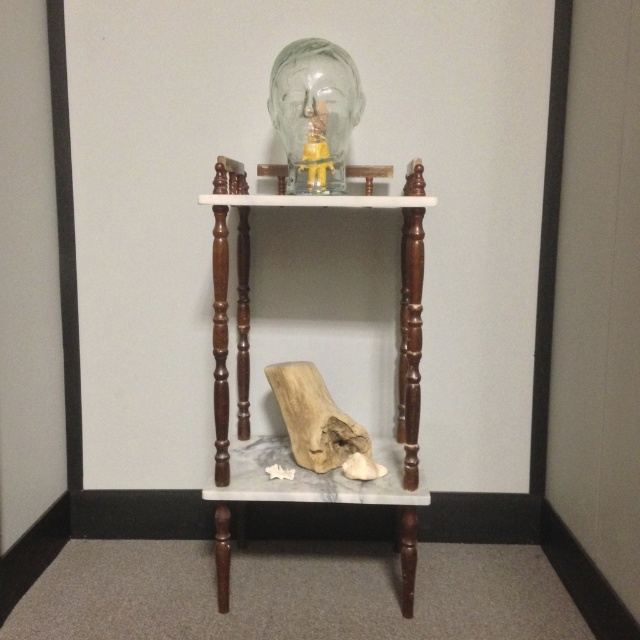
Question: Is wooden side table at center above white marble stool at lower center?

Choices:
 (A) yes
 (B) no

Answer: (A)

Question: Is wooden side table at center above white marble stool at lower center?

Choices:
 (A) no
 (B) yes

Answer: (B)

Question: Can you confirm if wooden side table at center is wider than white marble stool at lower center?

Choices:
 (A) yes
 (B) no

Answer: (A)

Question: Which point is farther from the camera taking this photo?

Choices:
 (A) (262, 440)
 (B) (205, 202)

Answer: (A)

Question: Which of the following is the closest to the observer?

Choices:
 (A) (246, 496)
 (B) (413, 472)

Answer: (B)